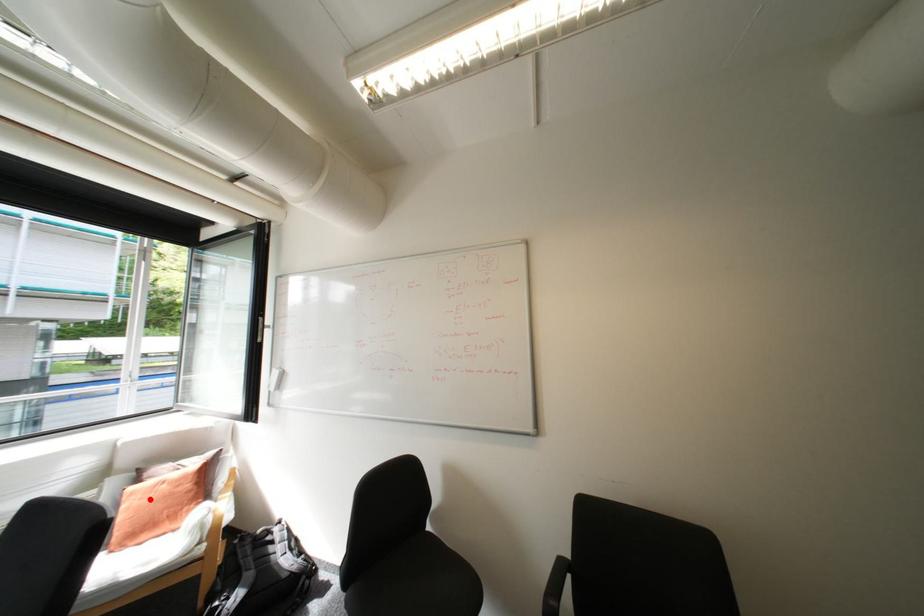
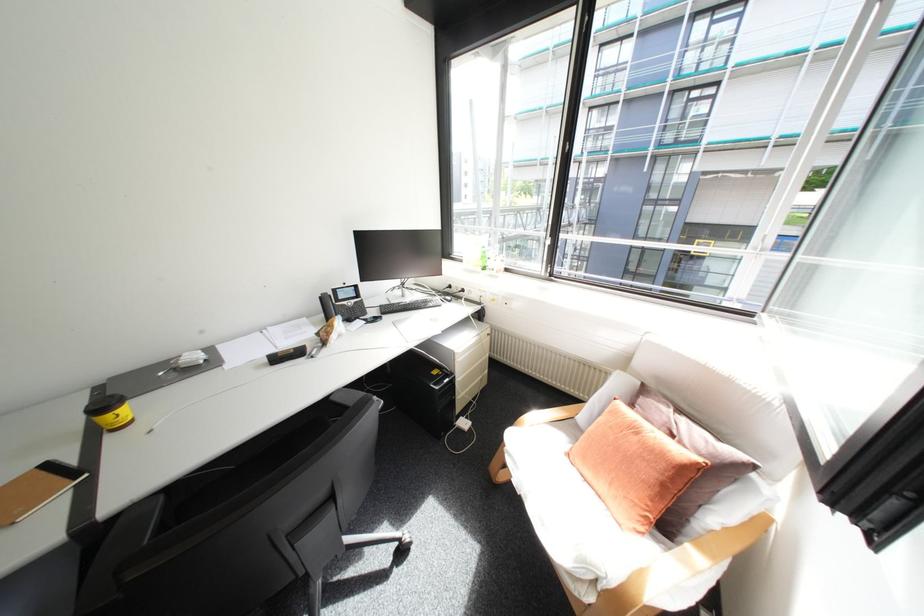
Question: I am providing you with two images of the same scene from different viewpoints. In image1, a red point is highlighted. Considering the same 3D point in image2, which of the following is correct?

Choices:
 (A) It is closer
 (B) It is farther

Answer: (A)